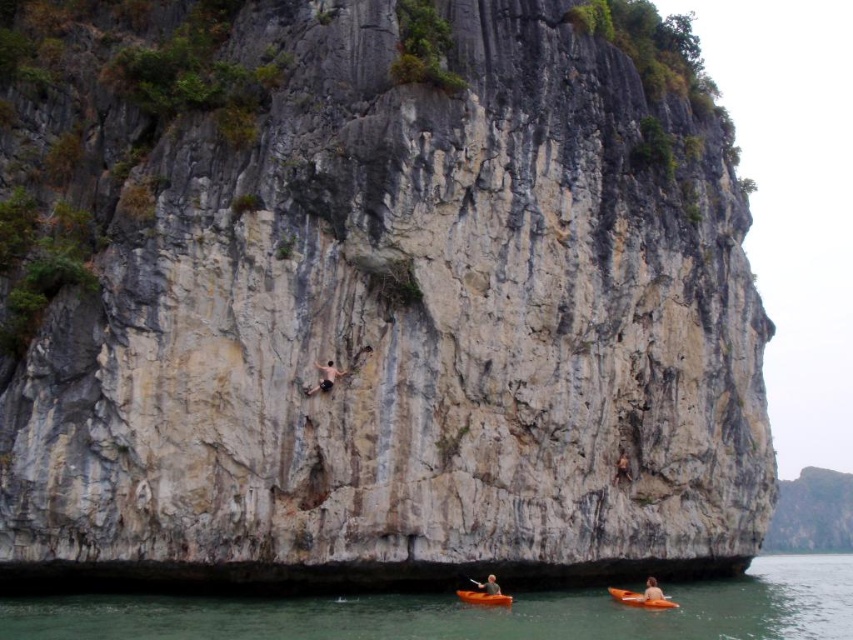
Is orange plastic kayak at lower right wider than light brown wood kayak at lower right?

Indeed, orange plastic kayak at lower right has a greater width compared to light brown wood kayak at lower right.

Describe the element at coordinates (642, 598) in the screenshot. This screenshot has height=640, width=853. I see `orange plastic kayak at lower right` at that location.

Locate an element on the screen. The width and height of the screenshot is (853, 640). orange plastic kayak at lower right is located at coordinates (642, 598).

Is point (364, 612) positioned before point (619, 456)?

Yes, it is in front of point (619, 456).

Which is more to the left, green water at lower center or smooth skin person at center?

smooth skin person at center

Between point (598, 625) and point (618, 468), which one is positioned behind?

Positioned behind is point (618, 468).

Where is `green water at lower center`? The image size is (853, 640). green water at lower center is located at coordinates (469, 612).

Who is positioned more to the right, black skin at center or smooth skin person at center?

smooth skin person at center is more to the right.

The image size is (853, 640). In order to click on black skin at center in this screenshot , I will do `click(323, 378)`.

Locate an element on the screen. black skin at center is located at coordinates (323, 378).